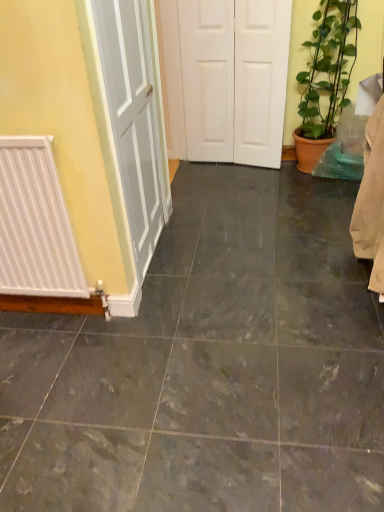
The width and height of the screenshot is (384, 512). Describe the element at coordinates (35, 224) in the screenshot. I see `white matte radiator at left` at that location.

Image resolution: width=384 pixels, height=512 pixels. What do you see at coordinates (234, 79) in the screenshot? I see `white matte door at center` at bounding box center [234, 79].

Identify the location of marble tile at center. The height and width of the screenshot is (512, 384). (210, 366).

Measure the distance between white matte door at center and white matte radiator at left.

A distance of 1.91 meters exists between white matte door at center and white matte radiator at left.

Based on the photo, from the image's perspective, is white matte door at center beneath white matte radiator at left?

Incorrect, from the image's perspective, white matte door at center is higher than white matte radiator at left.

Locate an element on the screen. This screenshot has height=512, width=384. radiator located on the left of white matte door at center is located at coordinates (35, 224).

Is white matte door at center at the left side of white matte radiator at left?

No, white matte door at center is not to the left of white matte radiator at left.

What's the angular difference between white matte radiator at left and green leafy plant at right's facing directions?

There is a 2.46-degree angle between the facing directions of white matte radiator at left and green leafy plant at right.

In the scene shown: Can you confirm if white matte radiator at left is wider than green leafy plant at right?

Incorrect, the width of white matte radiator at left does not surpass that of green leafy plant at right.

From the image's perspective, is white matte radiator at left above or below green leafy plant at right?

From the image's perspective, white matte radiator at left appears below green leafy plant at right.

Is white matte door at center bigger or smaller than marble tile at center?

Clearly, white matte door at center is smaller in size than marble tile at center.

What's the angular difference between white matte door at center and marble tile at center's facing directions?

white matte door at center and marble tile at center are facing 173 degrees away from each other.

The width and height of the screenshot is (384, 512). In order to click on ceramic tile below the white matte door at center (from a real-world perspective) in this screenshot , I will do `click(210, 366)`.

Is white matte door at center looking in the opposite direction of marble tile at center?

That's not correct — white matte door at center is not looking away from marble tile at center.

In the image, is white matte radiator at left positioned in front of or behind marble tile at center?

Visually, white matte radiator at left is located behind marble tile at center.

Is point (10, 136) more distant than point (43, 393)?

No, (10, 136) is closer to viewer.

Is white matte radiator at left taller or shorter than marble tile at center?

In the image, white matte radiator at left appears to be taller than marble tile at center.

Does white matte radiator at left have a lesser width compared to marble tile at center?

Yes, white matte radiator at left is thinner than marble tile at center.

Is marble tile at center at the right side of green leafy plant at right?

No.

Is point (341, 222) in front of point (328, 1)?

Yes, it is.

Is marble tile at center not close to green leafy plant at right?

Yes, marble tile at center is far from green leafy plant at right.

How many degrees apart are the facing directions of green leafy plant at right and marble tile at center?

The facing directions of green leafy plant at right and marble tile at center are 178 degrees apart.

Which of these two, green leafy plant at right or marble tile at center, is bigger?

green leafy plant at right is bigger.

Looking at this image, does green leafy plant at right touch marble tile at center?

green leafy plant at right and marble tile at center are not in contact.

From the image's perspective, between green leafy plant at right and marble tile at center, who is located below?

marble tile at center, from the image's perspective.

What's the angular difference between green leafy plant at right and white matte door at center's facing directions?

There is a 5.81-degree angle between the facing directions of green leafy plant at right and white matte door at center.

In the scene shown: Which object is further away from the camera taking this photo, green leafy plant at right or white matte door at center?

white matte door at center is further from the camera.

From the image's perspective, is green leafy plant at right above or below white matte door at center?

Based on their image positions, green leafy plant at right is located beneath white matte door at center.

Based on the photo, from a real-world perspective, is green leafy plant at right over white matte door at center?

No, from a real-world perspective, green leafy plant at right is not over white matte door at center

The image size is (384, 512). What are the coordinates of `radiator below the white matte door at center (from the image's perspective)` in the screenshot? It's located at (35, 224).

Where is `radiator on the left of green leafy plant at right`? The width and height of the screenshot is (384, 512). radiator on the left of green leafy plant at right is located at coordinates (35, 224).

From the image, which object appears to be farther from white matte radiator at left, white matte door at center or green leafy plant at right?

green leafy plant at right is positioned further to the anchor white matte radiator at left.

Looking at the image, which one is located closer to marble tile at center, white matte radiator at left or white matte door at center?

white matte radiator at left is closer to marble tile at center.

Estimate the real-world distances between objects in this image. Which object is closer to white matte radiator at left, green leafy plant at right or white matte door at center?

white matte door at center is closer to white matte radiator at left.

Based on their spatial positions, is white matte radiator at left or green leafy plant at right further from white matte door at center?

Among the two, white matte radiator at left is located further to white matte door at center.

Looking at the image, which one is located further to white matte door at center, white matte radiator at left or marble tile at center?

Based on the image, white matte radiator at left appears to be further to white matte door at center.

Which object lies further to the anchor point green leafy plant at right, white matte radiator at left or marble tile at center?

white matte radiator at left is positioned further to the anchor green leafy plant at right.

From the picture: When comparing their distances from white matte radiator at left, does marble tile at center or white matte door at center seem closer?

Based on the image, marble tile at center appears to be nearer to white matte radiator at left.

Based on their spatial positions, is white matte door at center or green leafy plant at right closer to marble tile at center?

Based on the image, white matte door at center appears to be nearer to marble tile at center.

You are a GUI agent. You are given a task and a screenshot of the screen. Output one action in this format:
    pyautogui.click(x=<x>, y=<y>)
    Task: Click on the door between white matte radiator at left and green leafy plant at right in the horizontal direction
    Image resolution: width=384 pixels, height=512 pixels.
    Given the screenshot: What is the action you would take?
    (234, 79)

Where is `radiator located between marble tile at center and white matte door at center in the depth direction`? Image resolution: width=384 pixels, height=512 pixels. radiator located between marble tile at center and white matte door at center in the depth direction is located at coordinates (35, 224).

Identify the location of ceramic tile between white matte radiator at left and green leafy plant at right. The image size is (384, 512). (210, 366).

Where is `houseplant positioned between marble tile at center and white matte door at center from near to far`? The width and height of the screenshot is (384, 512). houseplant positioned between marble tile at center and white matte door at center from near to far is located at coordinates (325, 78).